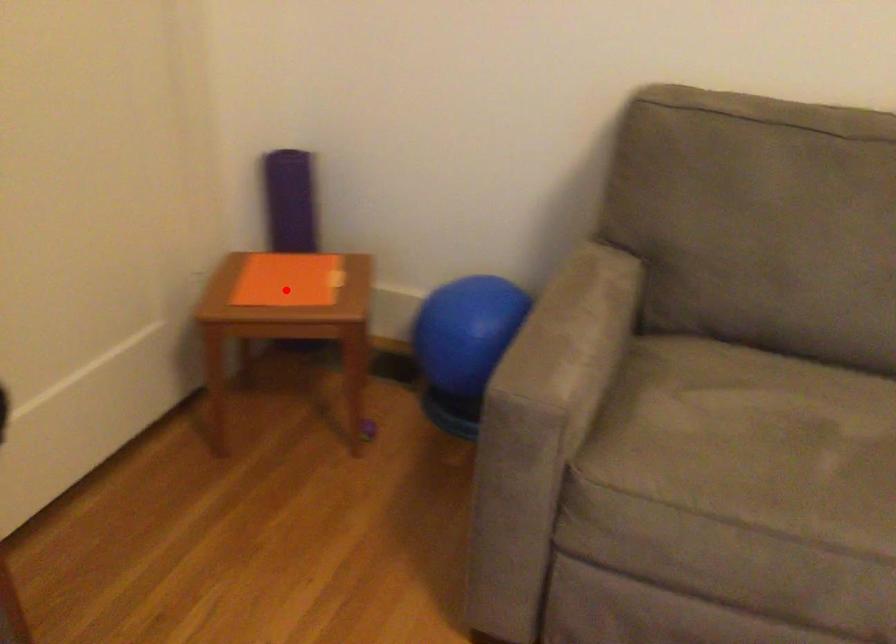
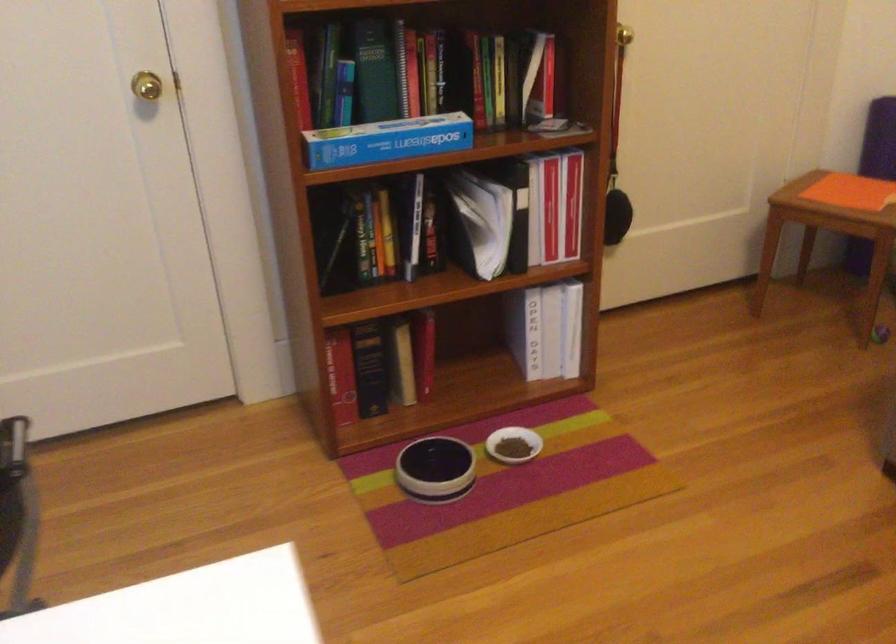
Locate, in the second image, the point that corresponds to the highlighted location in the first image.

(840, 196)